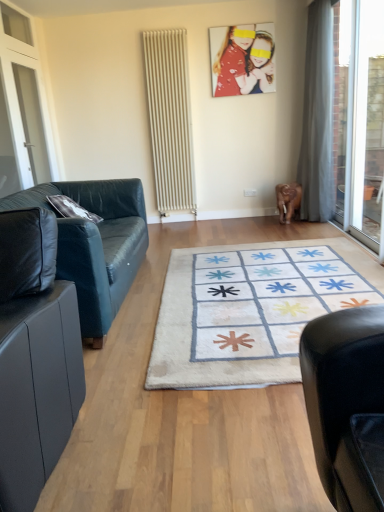
Question: Does gray fabric curtain at right have a larger size compared to white glass screen door at left?

Choices:
 (A) no
 (B) yes

Answer: (B)

Question: From the image's perspective, is gray fabric curtain at right above white glass screen door at left?

Choices:
 (A) yes
 (B) no

Answer: (A)

Question: Can you see gray fabric curtain at right touching white glass screen door at left?

Choices:
 (A) yes
 (B) no

Answer: (B)

Question: Is gray fabric curtain at right smaller than white glass screen door at left?

Choices:
 (A) no
 (B) yes

Answer: (A)

Question: From the image's perspective, is gray fabric curtain at right beneath white glass screen door at left?

Choices:
 (A) yes
 (B) no

Answer: (B)

Question: In terms of width, does white soft rug at center look wider or thinner when compared to matte plastic photo frame at upper center?

Choices:
 (A) thin
 (B) wide

Answer: (B)

Question: Choose the correct answer: Is white soft rug at center inside matte plastic photo frame at upper center or outside it?

Choices:
 (A) inside
 (B) outside

Answer: (B)

Question: Based on their sizes in the image, would you say white soft rug at center is bigger or smaller than matte plastic photo frame at upper center?

Choices:
 (A) small
 (B) big

Answer: (B)

Question: From a real-world perspective, is white soft rug at center physically located above or below matte plastic photo frame at upper center?

Choices:
 (A) above
 (B) below

Answer: (B)

Question: Would you say beige textured radiator at center is inside or outside black leather couch at left, the 1th studio couch viewed from the front?

Choices:
 (A) outside
 (B) inside

Answer: (A)

Question: From a real-world perspective, is beige textured radiator at center above or below black leather couch at left, arranged as the second studio couch when viewed from the back?

Choices:
 (A) below
 (B) above

Answer: (B)

Question: In terms of size, does beige textured radiator at center appear bigger or smaller than black leather couch at left, arranged as the second studio couch when viewed from the back?

Choices:
 (A) small
 (B) big

Answer: (A)

Question: Visually, is beige textured radiator at center positioned to the left or to the right of black leather couch at left, arranged as the second studio couch when viewed from the back?

Choices:
 (A) right
 (B) left

Answer: (A)

Question: Is point (36, 150) closer or farther from the camera than point (185, 151)?

Choices:
 (A) farther
 (B) closer

Answer: (B)

Question: Is white glass screen door at left taller or shorter than beige textured radiator at center?

Choices:
 (A) short
 (B) tall

Answer: (A)